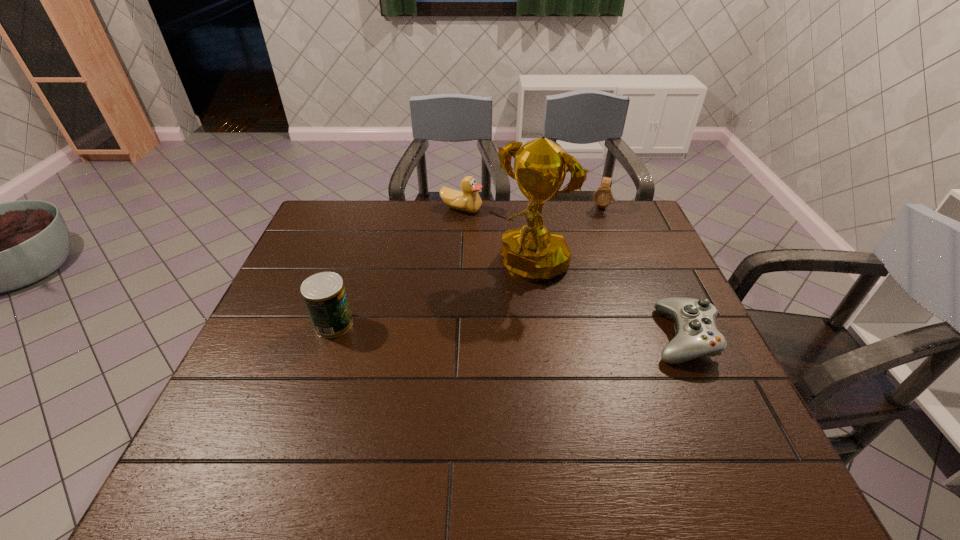
Identify the location of vacant space situated on the face of the watch. Image resolution: width=960 pixels, height=540 pixels. (588, 244).

Where is `blank space located 0.400m on the front side of the award`? The width and height of the screenshot is (960, 540). blank space located 0.400m on the front side of the award is located at coordinates (423, 384).

At what (x,y) coordinates should I click in order to perform the action: click on free spot located on the front side of the award. Please return your answer as a coordinate pair (x, y). Image resolution: width=960 pixels, height=540 pixels. Looking at the image, I should click on (448, 355).

At what (x,y) coordinates should I click in order to perform the action: click on free space located 0.310m on the front side of the award. Please return your answer as a coordinate pair (x, y). Looking at the image, I should click on (445, 357).

I want to click on free space located 0.370m at the beak of the second object from left to right, so click(513, 283).

Find the location of a particular element. The image size is (960, 540). vacant space located 0.180m at the beak of the second object from left to right is located at coordinates point(488,246).

You are a GUI agent. You are given a task and a screenshot of the screen. Output one action in this format:
    pyautogui.click(x=<x>, y=<y>)
    Task: Click on the vacant space situated 0.330m at the beak of the second object from left to right
    The width and height of the screenshot is (960, 540).
    Given the screenshot: What is the action you would take?
    pyautogui.click(x=507, y=274)

At what (x,y) coordinates should I click in order to perform the action: click on watch that is at the far edge. Please return your answer as a coordinate pair (x, y). This screenshot has height=540, width=960. Looking at the image, I should click on (603, 196).

This screenshot has height=540, width=960. I want to click on duck that is at the far edge, so click(x=468, y=200).

What are the coordinates of `object present at the left edge` in the screenshot? It's located at (324, 294).